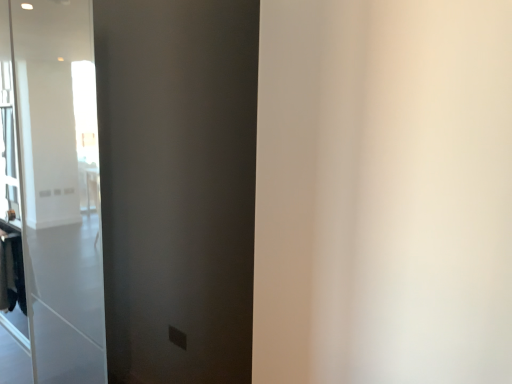
Question: Should I look upward or downward to see matte black barn door at center?

Choices:
 (A) down
 (B) up

Answer: (A)

Question: From a real-world perspective, is matte black barn door at center positioned under dark brown fabric laundry at lower left based on gravity?

Choices:
 (A) no
 (B) yes

Answer: (A)

Question: Is dark brown fabric laundry at lower left surrounded by matte black barn door at center?

Choices:
 (A) yes
 (B) no

Answer: (B)

Question: Are matte black barn door at center and dark brown fabric laundry at lower left beside each other?

Choices:
 (A) yes
 (B) no

Answer: (B)

Question: Is matte black barn door at center located outside dark brown fabric laundry at lower left?

Choices:
 (A) no
 (B) yes

Answer: (B)

Question: Is matte black barn door at center thinner than dark brown fabric laundry at lower left?

Choices:
 (A) yes
 (B) no

Answer: (B)

Question: Is matte black barn door at center positioned before dark brown fabric laundry at lower left?

Choices:
 (A) yes
 (B) no

Answer: (A)

Question: Is dark brown fabric laundry at lower left closer to camera compared to matte black barn door at center?

Choices:
 (A) yes
 (B) no

Answer: (B)

Question: Is dark brown fabric laundry at lower left taller than matte black barn door at center?

Choices:
 (A) yes
 (B) no

Answer: (B)

Question: From a real-world perspective, does dark brown fabric laundry at lower left stand above matte black barn door at center?

Choices:
 (A) yes
 (B) no

Answer: (B)

Question: Can matte black barn door at center be found inside dark brown fabric laundry at lower left?

Choices:
 (A) no
 (B) yes

Answer: (A)

Question: Is dark brown fabric laundry at lower left aimed at matte black barn door at center?

Choices:
 (A) yes
 (B) no

Answer: (B)

Question: Does dark brown fabric laundry at lower left have a larger size compared to matte black barn door at center?

Choices:
 (A) yes
 (B) no

Answer: (B)

Question: Is matte black barn door at center spatially inside dark brown fabric laundry at lower left, or outside of it?

Choices:
 (A) outside
 (B) inside

Answer: (A)